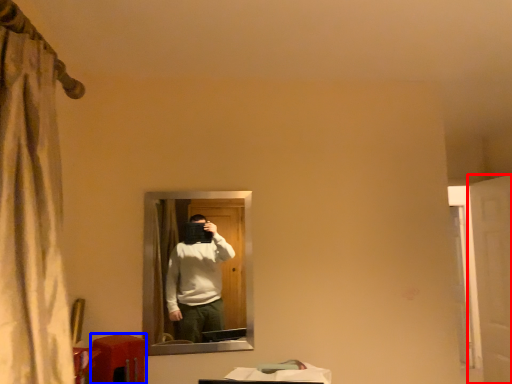
Question: Which object is further to the camera taking this photo, screen door (highlighted by a red box) or table (highlighted by a blue box)?

Choices:
 (A) screen door
 (B) table

Answer: (A)